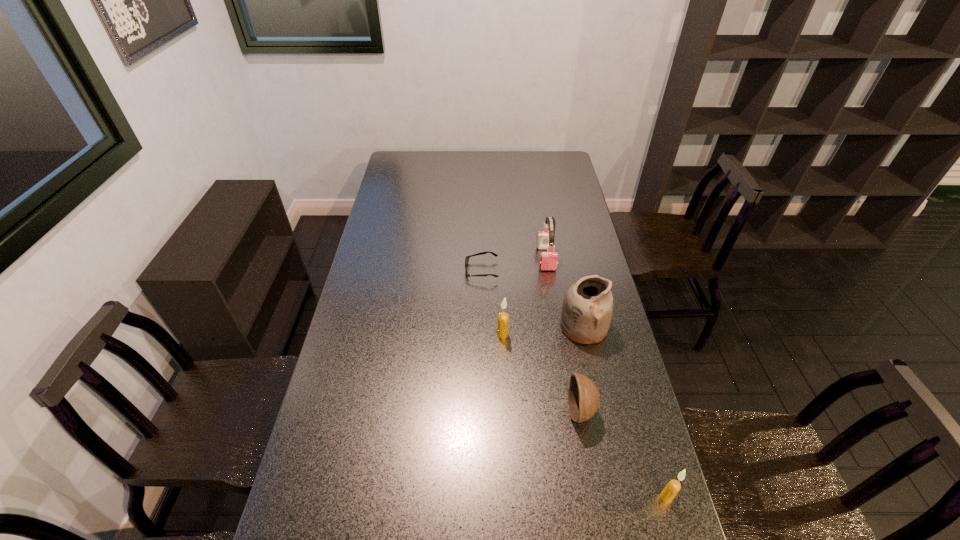
Identify the location of the farther candle. This screenshot has height=540, width=960. (503, 318).

You are a GUI agent. You are given a task and a screenshot of the screen. Output one action in this format:
    pyautogui.click(x=<x>, y=<y>)
    Task: Click on the left candle
    Image resolution: width=960 pixels, height=540 pixels.
    Given the screenshot: What is the action you would take?
    pyautogui.click(x=503, y=318)

The image size is (960, 540). I want to click on the rightmost object, so click(x=673, y=487).

At what (x,y) coordinates should I click in order to perform the action: click on the nearest object. Please return your answer as a coordinate pair (x, y). Looking at the image, I should click on (x=673, y=487).

You are a GUI agent. You are given a task and a screenshot of the screen. Output one action in this format:
    pyautogui.click(x=<x>, y=<y>)
    Task: Click on the pottery
    This screenshot has height=540, width=960.
    Given the screenshot: What is the action you would take?
    pyautogui.click(x=587, y=308)

At what (x,y) coordinates should I click in order to perform the action: click on earphone. Please return your answer as a coordinate pair (x, y). This screenshot has width=960, height=540. Looking at the image, I should click on (545, 240).

Where is `the shortest object`? The width and height of the screenshot is (960, 540). the shortest object is located at coordinates (467, 257).

The width and height of the screenshot is (960, 540). What are the coordinates of `the fifth farthest object` in the screenshot? It's located at (583, 396).

This screenshot has width=960, height=540. Find the location of `vacant area situated 0.050m on the back of the left candle`. vacant area situated 0.050m on the back of the left candle is located at coordinates (502, 319).

Identify the location of free space located on the back of the nearest object. The image size is (960, 540). (659, 471).